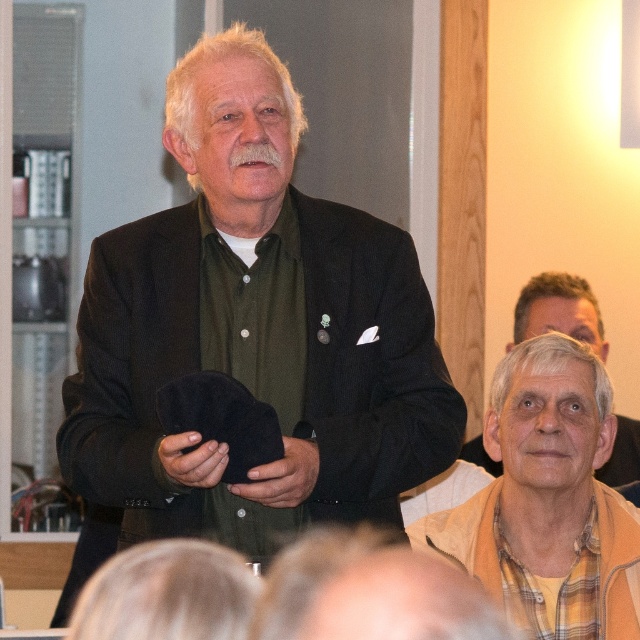
Question: Which point is closer to the camera?

Choices:
 (A) (508, 458)
 (B) (324, 333)
 (C) (550, 308)

Answer: (B)

Question: Can you confirm if dark green fabric shirt at center is positioned to the left of yellow plaid shirt at center?

Choices:
 (A) no
 (B) yes

Answer: (B)

Question: Does dark green fabric shirt at center come behind gray woolen sweater at lower right?

Choices:
 (A) yes
 (B) no

Answer: (B)

Question: Which point is closer to the camera?

Choices:
 (A) dark green fabric shirt at center
 (B) yellow plaid shirt at center
 (C) gray woolen sweater at lower right

Answer: (A)

Question: Which object appears farthest from the camera in this image?

Choices:
 (A) gray woolen sweater at lower right
 (B) dark green fabric shirt at center

Answer: (A)

Question: Does yellow plaid shirt at center appear on the left side of gray woolen sweater at lower right?

Choices:
 (A) yes
 (B) no

Answer: (A)